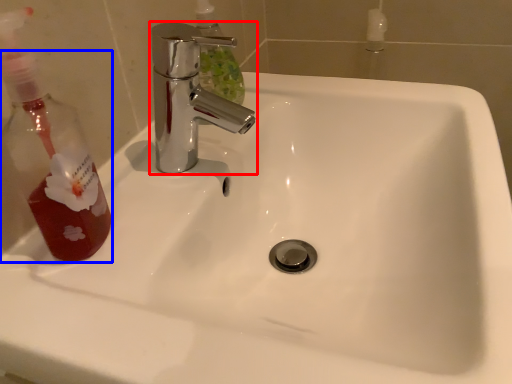
Question: Among these objects, which one is farthest to the camera, tap (highlighted by a red box) or mouthwash (highlighted by a blue box)?

Choices:
 (A) tap
 (B) mouthwash

Answer: (A)